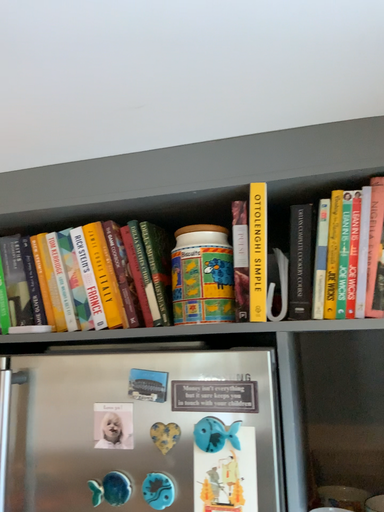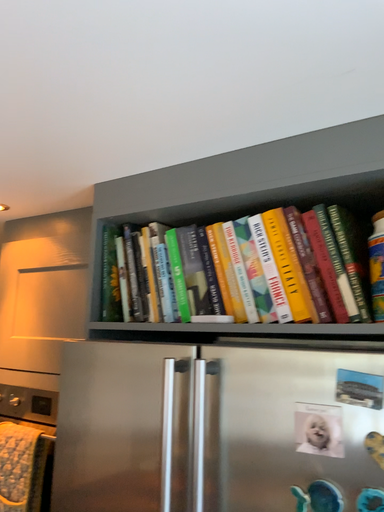
Question: Which way did the camera rotate in the video?

Choices:
 (A) rotated right
 (B) rotated left

Answer: (B)